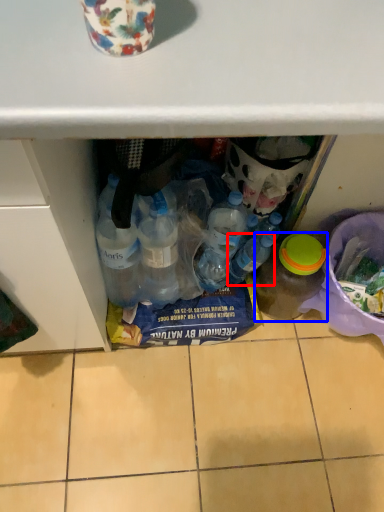
Question: Which object is closer to the camera taking this photo, bottle (highlighted by a red box) or bottle (highlighted by a blue box)?

Choices:
 (A) bottle
 (B) bottle

Answer: (B)